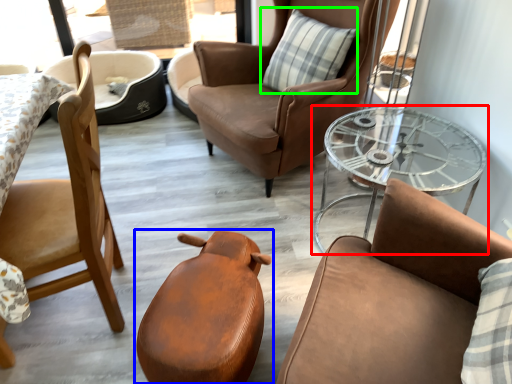
Question: Which object is positioned closest to table (highlighted by a red box)? Select from chair (highlighted by a blue box) and pillow (highlighted by a green box).

Choices:
 (A) chair
 (B) pillow

Answer: (B)